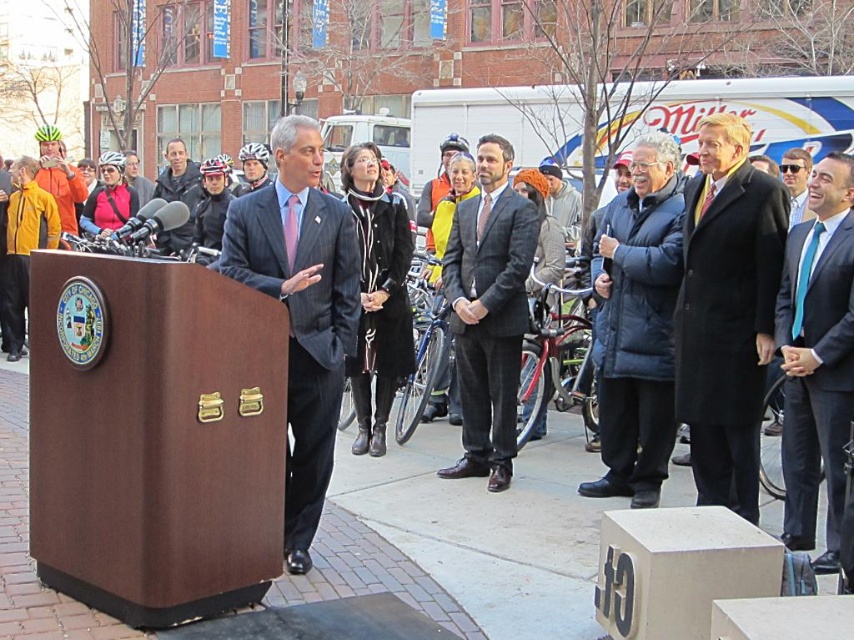
Can you confirm if dark blue puffer jacket at center is shorter than blue silk tie at right?

No.

Does dark blue puffer jacket at center have a smaller size compared to blue silk tie at right?

Incorrect, dark blue puffer jacket at center is not smaller in size than blue silk tie at right.

I want to click on dark blue puffer jacket at center, so point(636,323).

You are a GUI agent. You are given a task and a screenshot of the screen. Output one action in this format:
    pyautogui.click(x=<x>, y=<y>)
    Task: Click on the dark blue puffer jacket at center
    
    Given the screenshot: What is the action you would take?
    pyautogui.click(x=636, y=323)

Can you confirm if gray wool jacket at center is positioned to the right of blue silk tie at center?

In fact, gray wool jacket at center is to the left of blue silk tie at center.

Which is below, gray wool jacket at center or blue silk tie at center?

blue silk tie at center is lower down.

Locate an element on the screen. The height and width of the screenshot is (640, 854). gray wool jacket at center is located at coordinates (562, 202).

What are the coordinates of `dark blue suit at center` in the screenshot? It's located at (178, 193).

Which of these two, dark blue suit at center or gray wool jacket at center, stands shorter?

gray wool jacket at center is shorter.

Who is more forward, (179, 184) or (575, 192)?

Positioned in front is point (179, 184).

Find the location of `dark blue suit at center`. dark blue suit at center is located at coordinates (178, 193).